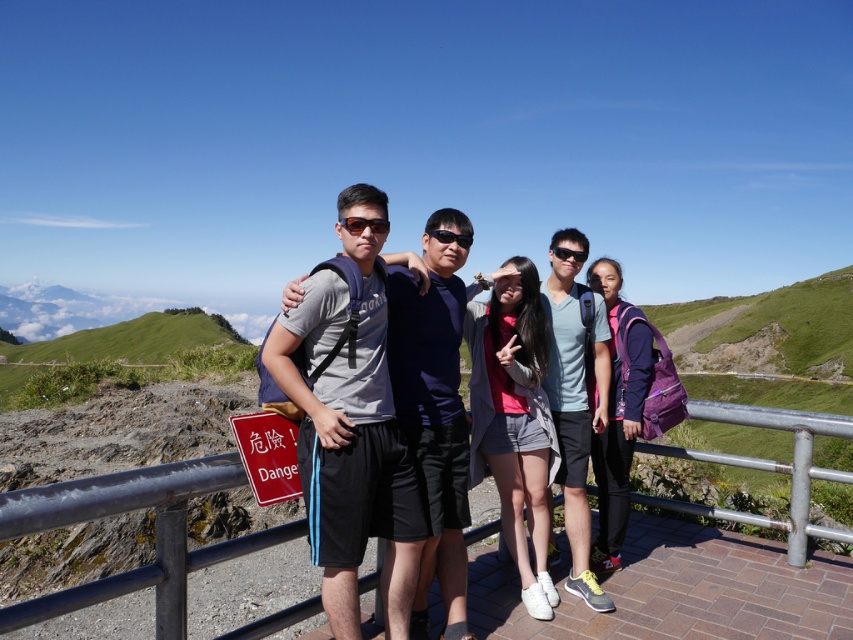
Is point (795, 445) farther from camera compared to point (555, 252)?

Yes, it is.

Does point (489, 460) come closer to viewer compared to point (577, 259)?

Yes, it is in front of point (577, 259).

Measure the distance between point (x=697, y=506) and camera.

A distance of 5.06 meters exists between point (x=697, y=506) and camera.

At what (x,y) coordinates should I click in order to perform the action: click on brushed metal rail at center. Please return your answer as a coordinate pair (x, y). This screenshot has width=853, height=640. Looking at the image, I should click on (155, 532).

Between brushed metal rail at center and black plastic goggles at center, which one has more height?

brushed metal rail at center is taller.

Can you confirm if brushed metal rail at center is taller than black plastic goggles at center?

Yes.

Who is more forward, [695,406] or [463,248]?

Point [463,248] is more forward.

The width and height of the screenshot is (853, 640). What are the coordinates of `brushed metal rail at center` in the screenshot? It's located at (155, 532).

Which is above, brushed metal rail at center or matte gray shirt at center?

matte gray shirt at center is higher up.

Which is in front, point (85, 504) or point (601, 369)?

Positioned in front is point (85, 504).

Locate an element on the screen. brushed metal rail at center is located at coordinates (155, 532).